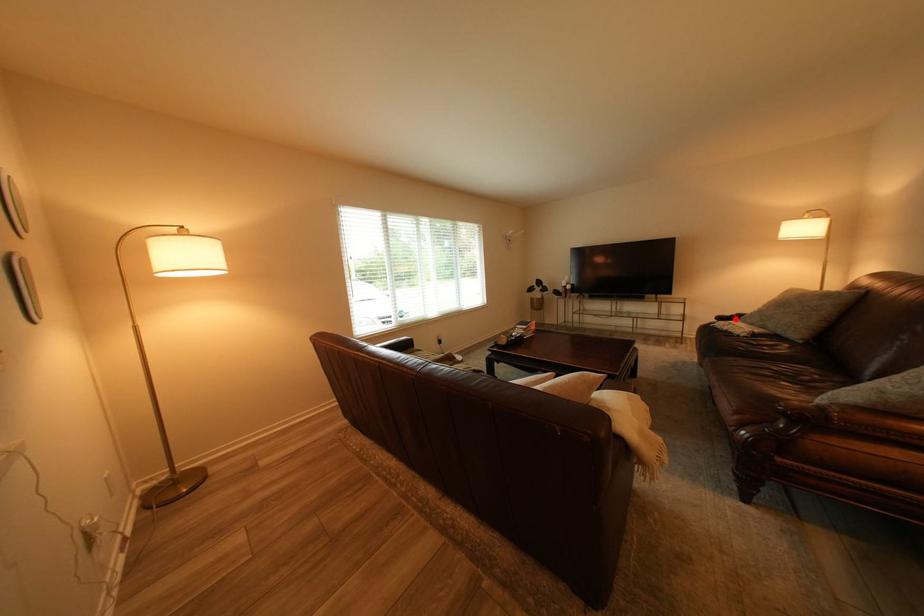
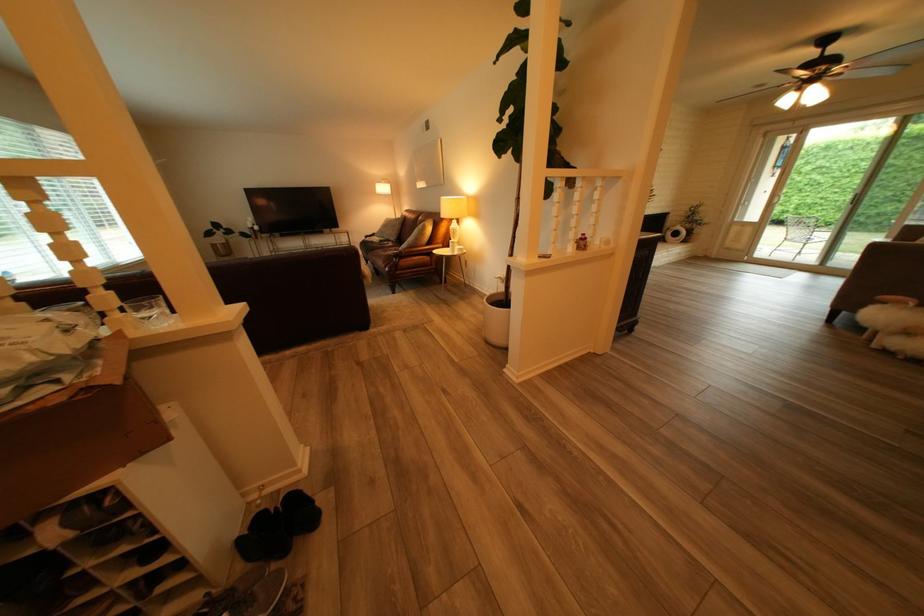
Locate, in the second image, the point that corresponds to the highlighted location in the first image.

(381, 238)